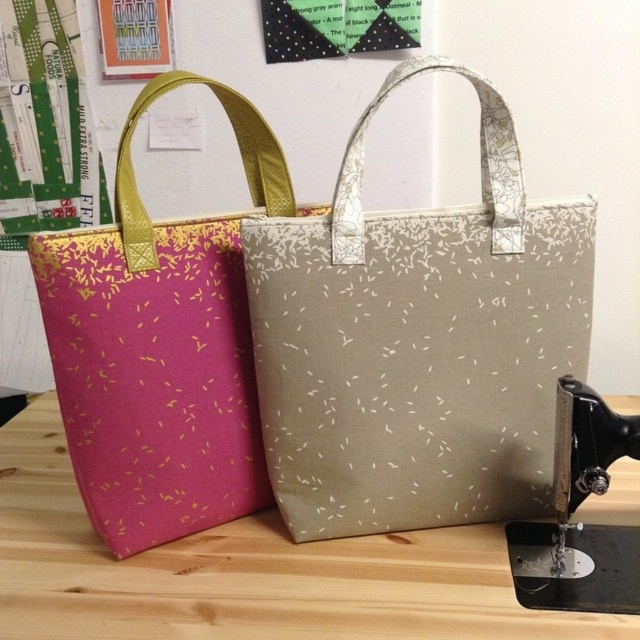
Question: Can you confirm if matte beige tote at center is thinner than metallic silver sewing machine at lower right?

Choices:
 (A) yes
 (B) no

Answer: (B)

Question: Among these objects, which one is farthest from the camera?

Choices:
 (A) pink fabric tote at left
 (B) matte beige tote at center

Answer: (A)

Question: Which of these objects is positioned closest to the metallic silver sewing machine at lower right?

Choices:
 (A) pink fabric tote at left
 (B) wooden table at center
 (C) matte beige tote at center

Answer: (C)

Question: Does matte beige tote at center appear under pink fabric tote at left?

Choices:
 (A) yes
 (B) no

Answer: (A)

Question: Does wooden table at center have a larger size compared to metallic silver sewing machine at lower right?

Choices:
 (A) no
 (B) yes

Answer: (B)

Question: Estimate the real-world distances between objects in this image. Which object is closer to the wooden table at center?

Choices:
 (A) matte beige tote at center
 (B) metallic silver sewing machine at lower right

Answer: (A)